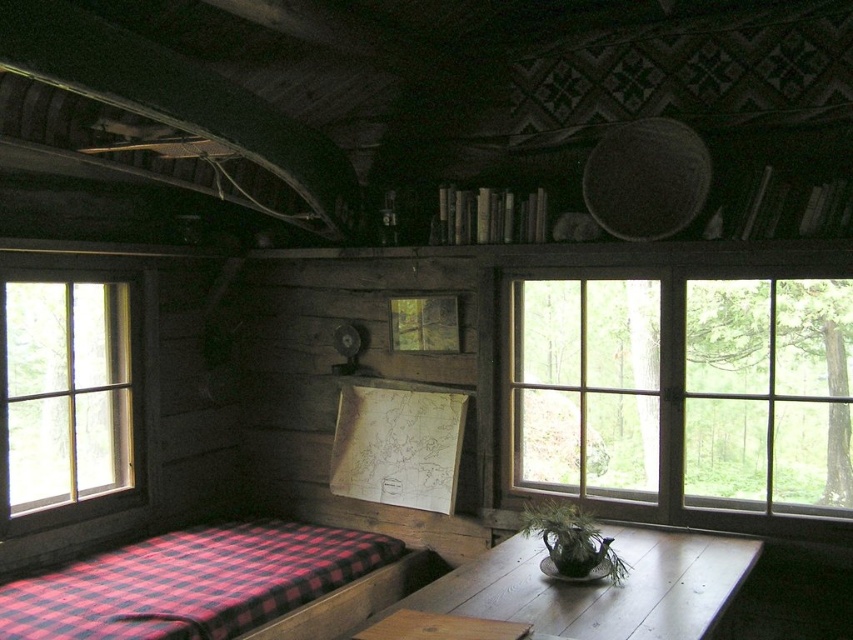
Question: Among these objects, which one is nearest to the camera?

Choices:
 (A) clear glass window at left
 (B) red checkered blanket at lower left
 (C) clear glass window at right
 (D) smooth wooden table at center

Answer: (D)

Question: Considering the real-world distances, which object is farthest from the smooth wooden table at center?

Choices:
 (A) clear glass window at left
 (B) red checkered blanket at lower left

Answer: (A)

Question: Can you confirm if clear glass window at left is thinner than smooth wooden table at center?

Choices:
 (A) no
 (B) yes

Answer: (B)

Question: Does red checkered blanket at lower left have a smaller size compared to smooth wooden table at center?

Choices:
 (A) yes
 (B) no

Answer: (B)

Question: Does clear glass window at right appear under red checkered blanket at lower left?

Choices:
 (A) yes
 (B) no

Answer: (B)

Question: Estimate the real-world distances between objects in this image. Which object is farther from the clear glass window at right?

Choices:
 (A) red checkered blanket at lower left
 (B) smooth wooden table at center
 (C) clear glass window at left

Answer: (C)